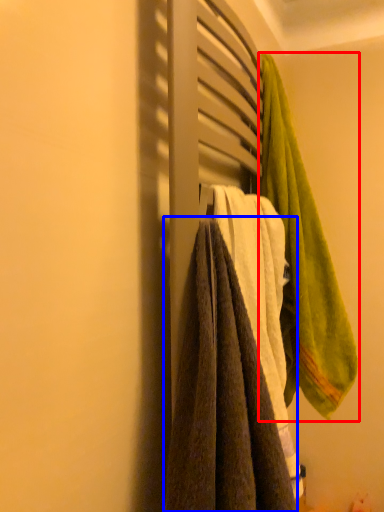
Question: Among these objects, which one is nearest to the camera, towel (highlighted by a red box) or towel (highlighted by a blue box)?

Choices:
 (A) towel
 (B) towel

Answer: (B)